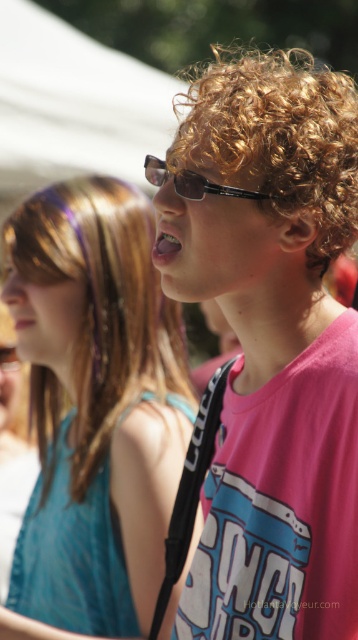
Does pink matte shirt at upper right have a lesser width compared to matte black sunglasses at center?

In fact, pink matte shirt at upper right might be wider than matte black sunglasses at center.

Is point (171, 627) farther from camera compared to point (195, 195)?

Yes, it is.

Find the location of a particular element. The width and height of the screenshot is (358, 640). pink matte shirt at upper right is located at coordinates pos(95,404).

Between pink matte shirt at center and curly golden hair at center, which one has more height?

pink matte shirt at center is taller.

Can you confirm if pink matte shirt at center is shorter than curly golden hair at center?

No.

Between point (176, 618) and point (339, 220), which one is positioned behind?

Positioned behind is point (176, 618).

Find the location of a particular element. pink matte shirt at center is located at coordinates (269, 342).

Is point (90, 348) positioned after point (220, 76)?

Yes, point (90, 348) is farther from viewer.

Locate an element on the screen. The image size is (358, 640). pink matte shirt at upper right is located at coordinates point(95,404).